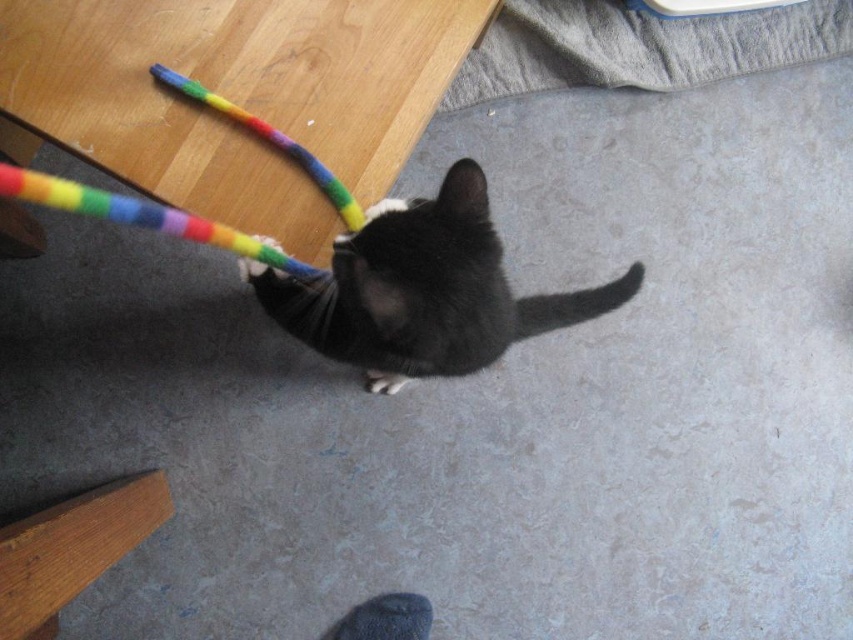
Question: Considering the real-world distances, which object is closest to the black matte fur cat at center?

Choices:
 (A) soft gray fabric at upper center
 (B) rainbow fabric toy at upper left

Answer: (B)

Question: Which object is farther from the camera taking this photo?

Choices:
 (A) soft gray fabric at upper center
 (B) black matte fur cat at center

Answer: (A)

Question: In this image, where is black matte fur cat at center located relative to soft gray fabric at upper center?

Choices:
 (A) below
 (B) above

Answer: (A)

Question: Which of these objects is positioned closest to the soft gray fabric at upper center?

Choices:
 (A) rainbow fabric toy at upper left
 (B) black matte fur cat at center

Answer: (B)

Question: Is black matte fur cat at center closer to the viewer compared to soft gray fabric at upper center?

Choices:
 (A) yes
 (B) no

Answer: (A)

Question: Does black matte fur cat at center have a greater width compared to rainbow fabric toy at upper left?

Choices:
 (A) yes
 (B) no

Answer: (B)